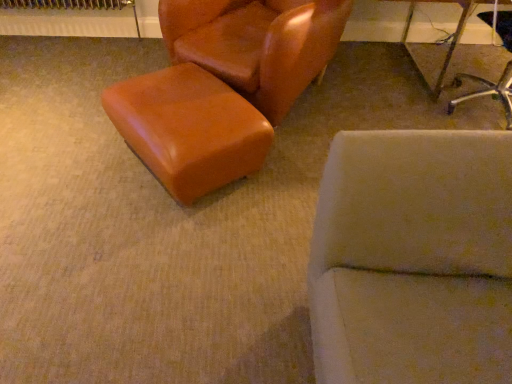
Question: Considering the relative sizes of satin brown ottoman at center and leather-like brown chair at upper left, the 1th chair viewed from the left, in the image provided, is satin brown ottoman at center shorter than leather-like brown chair at upper left, the 1th chair viewed from the left,?

Choices:
 (A) no
 (B) yes

Answer: (B)

Question: Is satin brown ottoman at center behind leather-like brown chair at upper left, the 1th chair viewed from the left?

Choices:
 (A) yes
 (B) no

Answer: (B)

Question: Is satin brown ottoman at center bigger than leather-like brown chair at upper left, the 1th chair viewed from the left?

Choices:
 (A) yes
 (B) no

Answer: (B)

Question: Is satin brown ottoman at center not close to leather-like brown chair at upper left, the 1th chair viewed from the left?

Choices:
 (A) no
 (B) yes

Answer: (A)

Question: Considering the relative sizes of satin brown ottoman at center and leather-like brown chair at upper left, which is the second chair in right-to-left order, in the image provided, is satin brown ottoman at center thinner than leather-like brown chair at upper left, which is the second chair in right-to-left order,?

Choices:
 (A) no
 (B) yes

Answer: (B)

Question: Is satin brown ottoman at center next to leather-like brown chair at upper left, the 1th chair viewed from the left, and touching it?

Choices:
 (A) no
 (B) yes

Answer: (A)

Question: Does satin brown ottoman at center have a smaller size compared to metallic silver chair at upper right, which is the first chair in right-to-left order?

Choices:
 (A) yes
 (B) no

Answer: (A)

Question: Is satin brown ottoman at center in contact with metallic silver chair at upper right, marked as the second chair in a left-to-right arrangement?

Choices:
 (A) yes
 (B) no

Answer: (B)

Question: Can you confirm if satin brown ottoman at center is wider than metallic silver chair at upper right, marked as the second chair in a left-to-right arrangement?

Choices:
 (A) no
 (B) yes

Answer: (A)

Question: Is metallic silver chair at upper right, marked as the second chair in a left-to-right arrangement, inside satin brown ottoman at center?

Choices:
 (A) no
 (B) yes

Answer: (A)

Question: Is satin brown ottoman at center bigger than metallic silver chair at upper right, which is the first chair in right-to-left order?

Choices:
 (A) yes
 (B) no

Answer: (B)

Question: Is satin brown ottoman at center shorter than metallic silver chair at upper right, marked as the second chair in a left-to-right arrangement?

Choices:
 (A) yes
 (B) no

Answer: (A)

Question: Considering the relative positions of metallic silver chair at upper right, which is the first chair in right-to-left order, and satin brown ottoman at center in the image provided, is metallic silver chair at upper right, which is the first chair in right-to-left order, to the left of satin brown ottoman at center from the viewer's perspective?

Choices:
 (A) yes
 (B) no

Answer: (B)